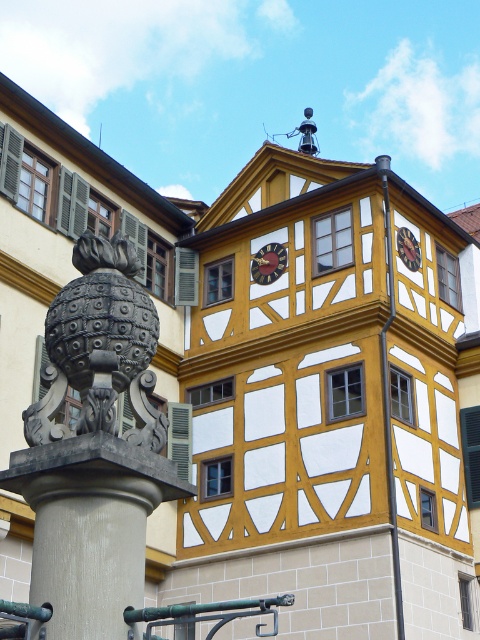
Is point (78, 289) closer to camera compared to point (252, 275)?

Yes, it is.

Which of these two, dark gray stone sphere at left or wooden clock at center, stands taller?

dark gray stone sphere at left is taller.

Who is more distant from viewer, (120, 339) or (282, 259)?

The point (282, 259) is behind.

Find the location of a particular element. This screenshot has width=480, height=640. dark gray stone sphere at left is located at coordinates (99, 348).

Between smooth gray stone column at lower left and wooden clock at center, which one appears on the right side from the viewer's perspective?

wooden clock at center is more to the right.

Does smooth gray stone column at lower left lie in front of wooden clock at center?

That is True.

In order to click on smooth gray stone column at lower left in this screenshot , I will do `click(91, 525)`.

Image resolution: width=480 pixels, height=640 pixels. In order to click on smooth gray stone column at lower left in this screenshot , I will do `click(91, 525)`.

Locate an element on the screen. smooth gray stone column at lower left is located at coordinates (91, 525).

How much distance is there between smooth gray stone column at lower left and dark gray stone sphere at left?

smooth gray stone column at lower left and dark gray stone sphere at left are 1.91 meters apart.

Which is behind, point (104, 451) or point (154, 440)?

The point (154, 440) is behind.

At what (x,y) coordinates should I click in order to perform the action: click on smooth gray stone column at lower left. Please return your answer as a coordinate pair (x, y). The height and width of the screenshot is (640, 480). Looking at the image, I should click on (91, 525).